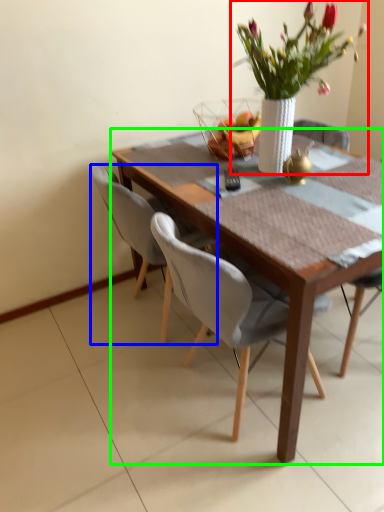
Question: Considering the real-world distances, which object is farthest from houseplant (highlighted by a red box)? chair (highlighted by a blue box) or kitchen & dining room table (highlighted by a green box)?

Choices:
 (A) chair
 (B) kitchen & dining room table

Answer: (A)